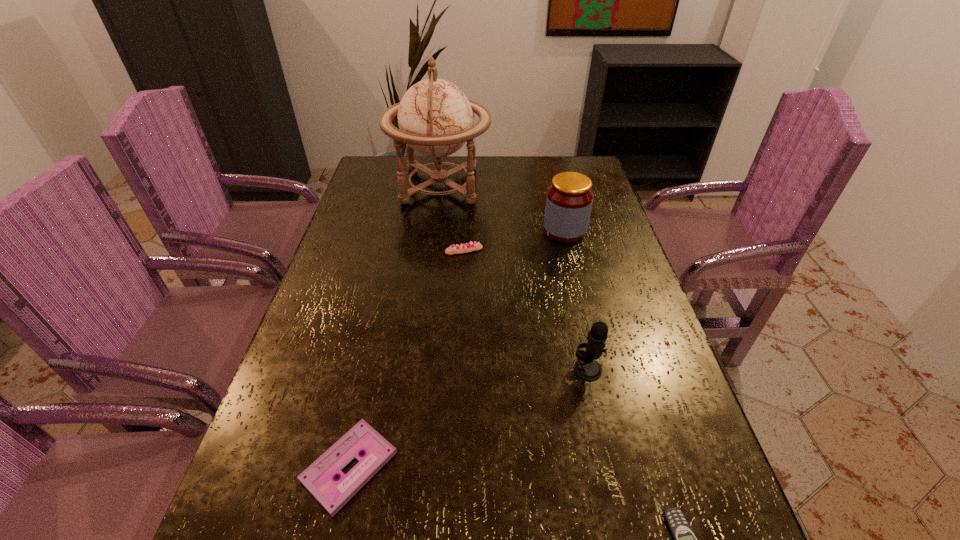
In the image, there is a desktop. In order to click on blank space at the right edge in this screenshot , I will do `click(604, 257)`.

Locate an element on the screen. Image resolution: width=960 pixels, height=540 pixels. free space between the tallest object and the microphone is located at coordinates (514, 278).

Where is `vacant space that is in between the fifth tallest object and the microphone`? Image resolution: width=960 pixels, height=540 pixels. vacant space that is in between the fifth tallest object and the microphone is located at coordinates point(468,418).

Where is `empty location between the videotape and the microphone`? empty location between the videotape and the microphone is located at coordinates (468, 418).

This screenshot has width=960, height=540. In order to click on vacant area that lies between the jar and the eclair in this screenshot , I will do `click(515, 240)`.

Locate an element on the screen. The width and height of the screenshot is (960, 540). free point between the videotape and the microphone is located at coordinates (468, 418).

Locate an element on the screen. The image size is (960, 540). vacant area that lies between the microphone and the tallest object is located at coordinates (514, 278).

The height and width of the screenshot is (540, 960). Identify the location of object that ranks as the closest to the farthest object. (569, 199).

In order to click on object that ranks as the fourth closest to the tallest object in this screenshot , I will do `click(319, 478)`.

The height and width of the screenshot is (540, 960). Identify the location of blank space that satisfies the following two spatial constraints: 1. on the front-facing side of the fourth nearest object; 2. on the left side of the tallest object. 432,251.